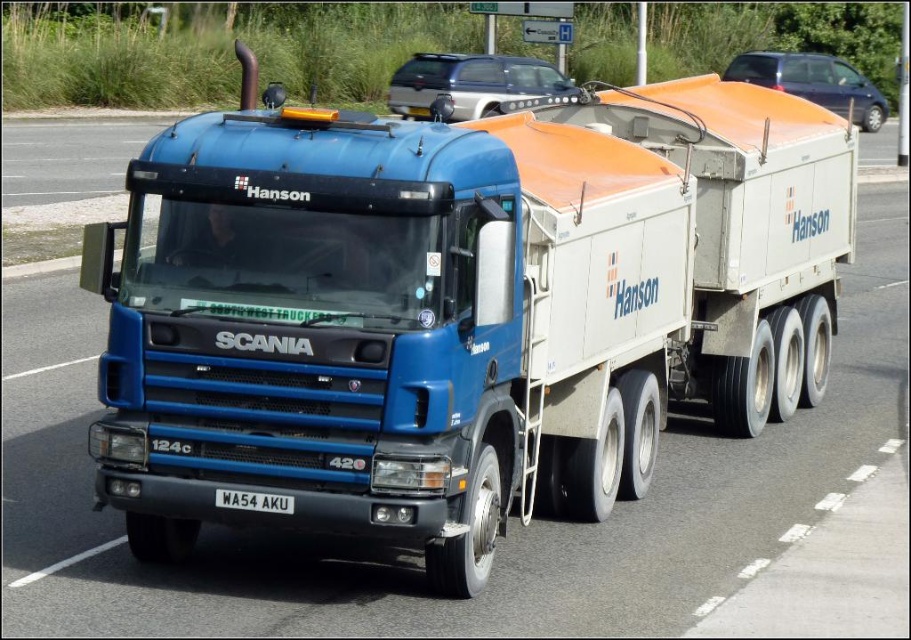
You are standing next to the silver metallic suv at upper center and want to take a photo of the Scania truck with the Hanson branding. The camera you have can focus on objects up to 10 meters away. Will you be able to take a clear photo of the Scania truck from your current position?

The silver metallic suv at upper center and camera are 9.74 meters apart. Since the camera can focus up to 10 meters, you can take a clear photo of the Scania truck from your current position.

You are a driver who needs to park your car behind the silver metallic suv at upper center and the white metallic license plate at center. Which vehicle should you park behind to ensure you have enough space for your car?

The silver metallic suv at upper center is larger in size than the white metallic license plate at center, so parking behind the silver metallic suv at upper center would provide more space for your car.